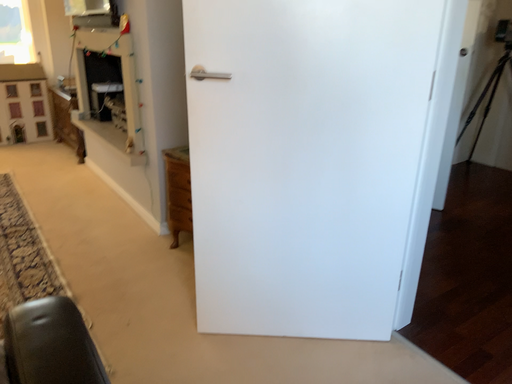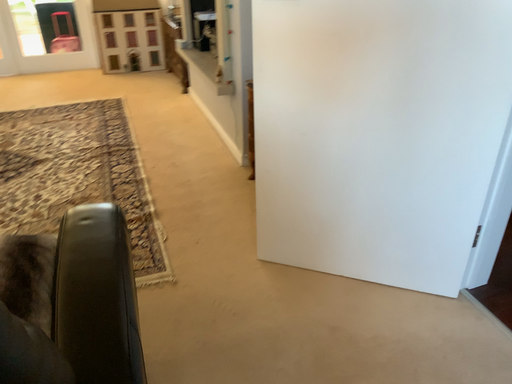
Question: How did the camera likely rotate when shooting the video?

Choices:
 (A) rotated downward
 (B) rotated upward

Answer: (A)